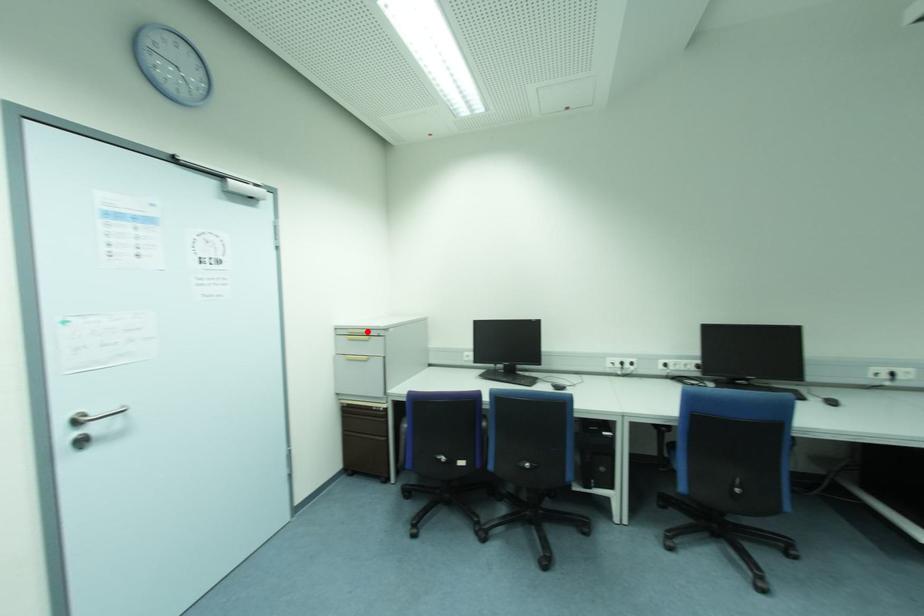
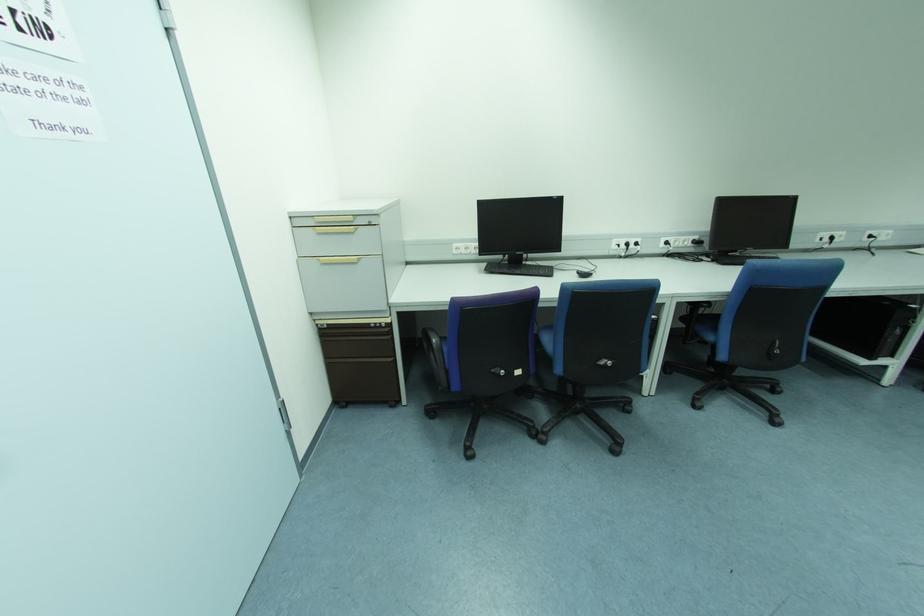
Where in the second image is the point corresponding to the highlighted location from the first image?

(350, 219)